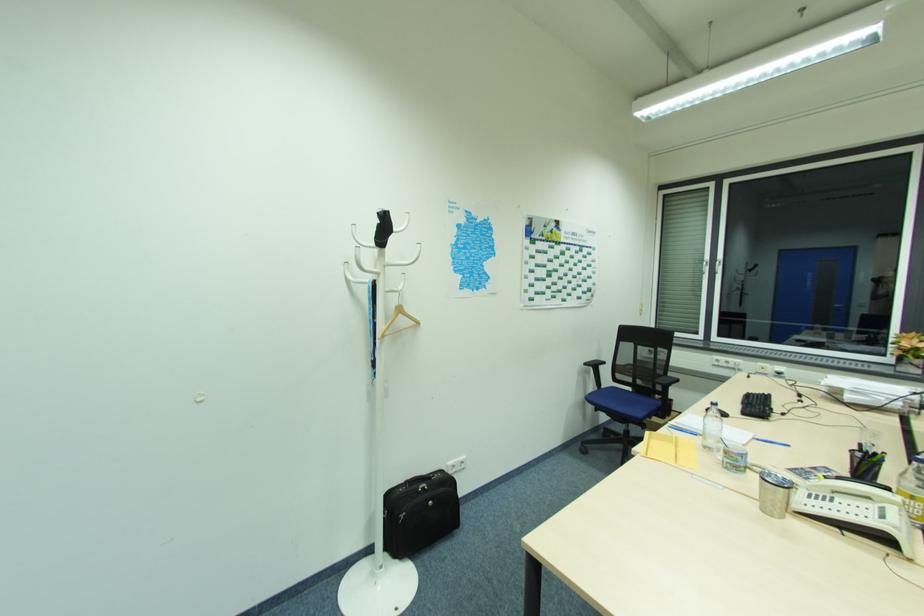
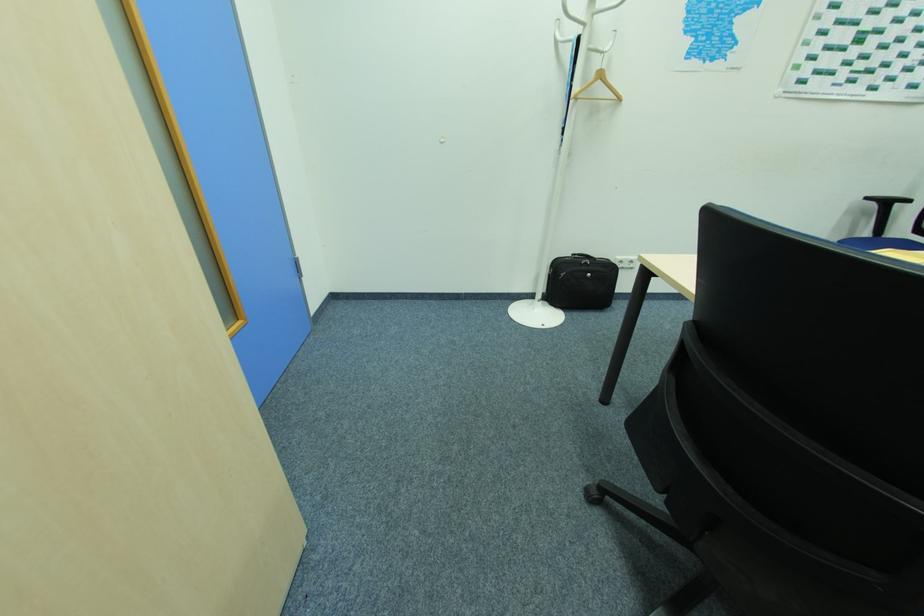
How did the camera likely rotate?

The camera rotated toward left-down.